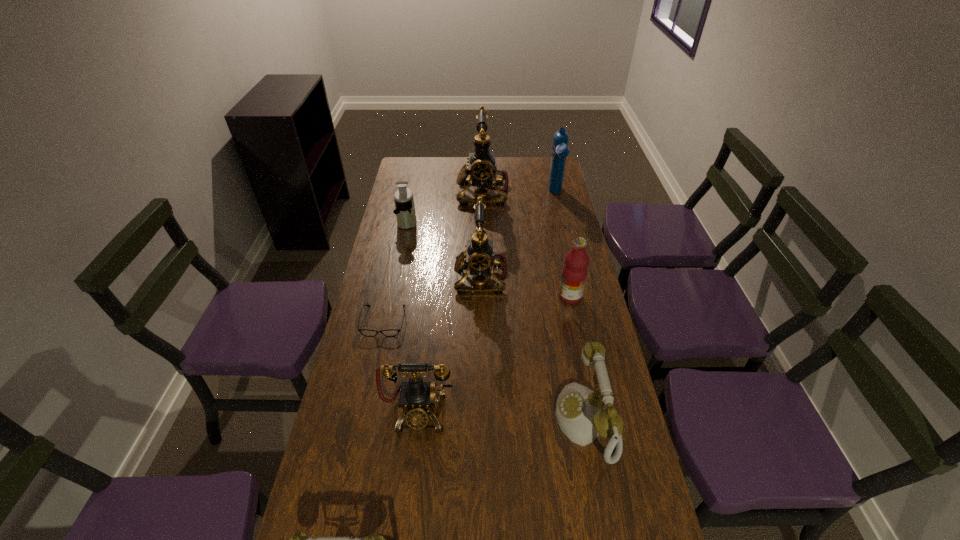
The width and height of the screenshot is (960, 540). What are the coordinates of `vacant space located on the label of the fruit juice` in the screenshot? It's located at (530, 296).

The height and width of the screenshot is (540, 960). Find the location of `free location located on the label of the fruit juice`. free location located on the label of the fruit juice is located at coordinates (544, 296).

Where is `vacant space located 0.140m on the front of the smallest black telephone, featuring the rotary dial`? Image resolution: width=960 pixels, height=540 pixels. vacant space located 0.140m on the front of the smallest black telephone, featuring the rotary dial is located at coordinates (410, 491).

At what (x,y) coordinates should I click in order to perform the action: click on free space located 0.160m on the back of the juicer. Please return your answer as a coordinate pair (x, y). Looking at the image, I should click on (413, 193).

The width and height of the screenshot is (960, 540). Identify the location of blank space located 0.100m on the dial of the farther white telephone. (518, 421).

Image resolution: width=960 pixels, height=540 pixels. I want to click on free space located on the dial of the farther white telephone, so click(482, 421).

Where is `free space located on the dial of the farther white telephone`? free space located on the dial of the farther white telephone is located at coordinates (422, 421).

Identify the location of free space located on the front-facing side of the fourth nearest object. (356, 451).

Locate an element on the screen. This screenshot has width=960, height=540. object that is at the far edge is located at coordinates (483, 172).

Identify the location of telephone located at the left edge. The height and width of the screenshot is (540, 960). (417, 400).